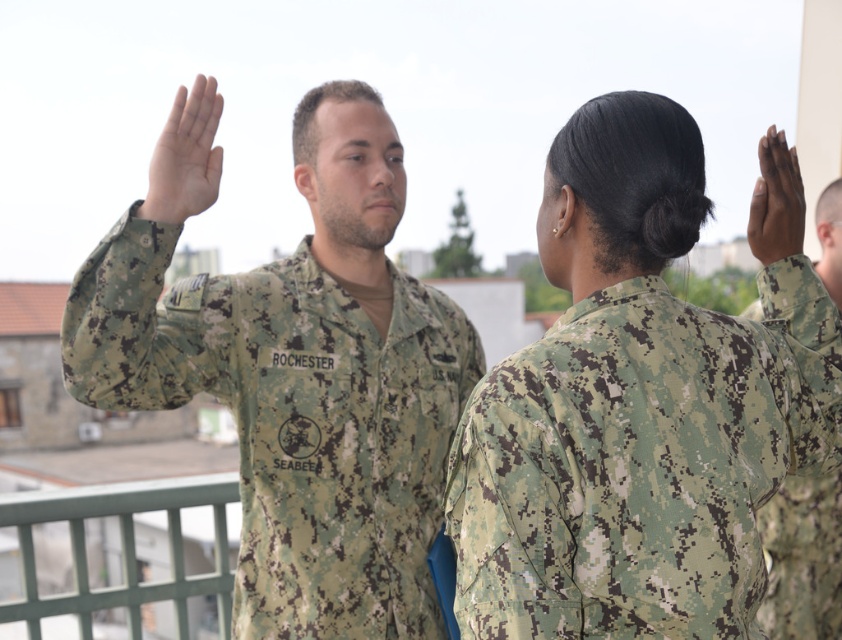
Does camouflage uniform at center appear over matte green uniform at upper center?

Actually, camouflage uniform at center is below matte green uniform at upper center.

Between camouflage uniform at center and matte green uniform at upper center, which one is positioned lower?

camouflage uniform at center is lower down.

The width and height of the screenshot is (842, 640). I want to click on camouflage uniform at center, so click(x=294, y=369).

Can you confirm if camouflage uniform at center is positioned to the left of dark brown matte skin at upper right?

Yes, camouflage uniform at center is to the left of dark brown matte skin at upper right.

Describe the element at coordinates (294, 369) in the screenshot. The width and height of the screenshot is (842, 640). I see `camouflage uniform at center` at that location.

At what (x,y) coordinates should I click in order to perform the action: click on camouflage uniform at center. Please return your answer as a coordinate pair (x, y). The image size is (842, 640). Looking at the image, I should click on (294, 369).

Image resolution: width=842 pixels, height=640 pixels. I want to click on camouflage uniform at center, so click(294, 369).

Between camouflage uniform at right and dark brown matte skin at upper right, which one appears on the left side from the viewer's perspective?

dark brown matte skin at upper right

Who is taller, camouflage uniform at right or dark brown matte skin at upper right?

camouflage uniform at right is taller.

Does point (781, 582) lie in front of point (787, 243)?

No, (781, 582) is further to viewer.

The width and height of the screenshot is (842, 640). What are the coordinates of `camouflage uniform at right` in the screenshot? It's located at (802, 557).